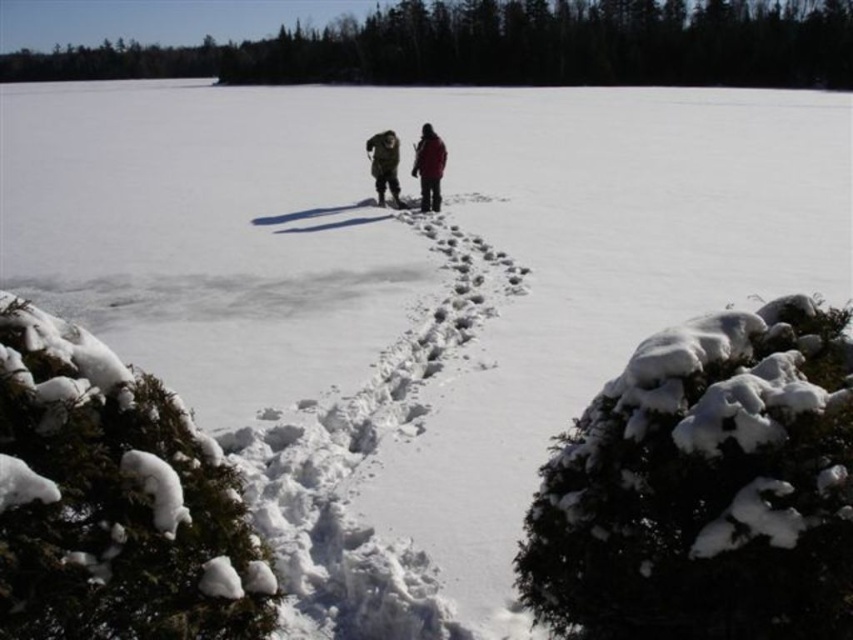
Which is more to the right, snow-covered pine at lower left or dark brown fur coat at center?

snow-covered pine at lower left is more to the right.

Is snow-covered pine at lower left further to the viewer compared to dark brown fur coat at center?

That is False.

This screenshot has height=640, width=853. Describe the element at coordinates (704, 486) in the screenshot. I see `snow-covered pine at lower left` at that location.

In order to click on snow-covered pine at lower left in this screenshot , I will do (704, 486).

Does red wool jacket at center have a greater width compared to dark green jacket at center?

Indeed, red wool jacket at center has a greater width compared to dark green jacket at center.

Is red wool jacket at center bigger than dark green jacket at center?

Indeed, red wool jacket at center has a larger size compared to dark green jacket at center.

Locate an element on the screen. This screenshot has width=853, height=640. red wool jacket at center is located at coordinates (428, 168).

Measure the distance from white fluffy snow trail at center to dark green jacket at center.

white fluffy snow trail at center and dark green jacket at center are 9.74 meters apart from each other.

Does white fluffy snow trail at center have a greater height compared to dark green jacket at center?

In fact, white fluffy snow trail at center may be shorter than dark green jacket at center.

Where is `white fluffy snow trail at center`? white fluffy snow trail at center is located at coordinates (367, 464).